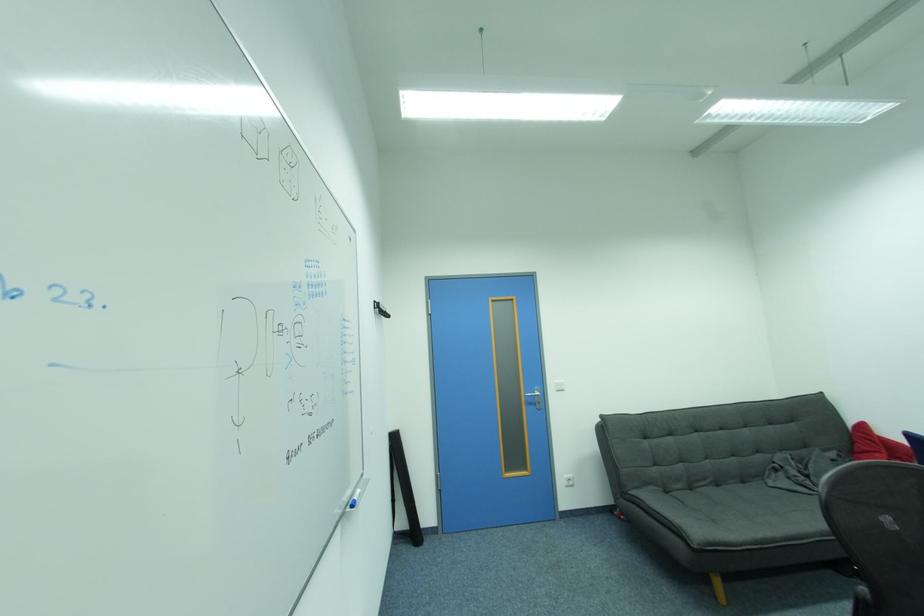
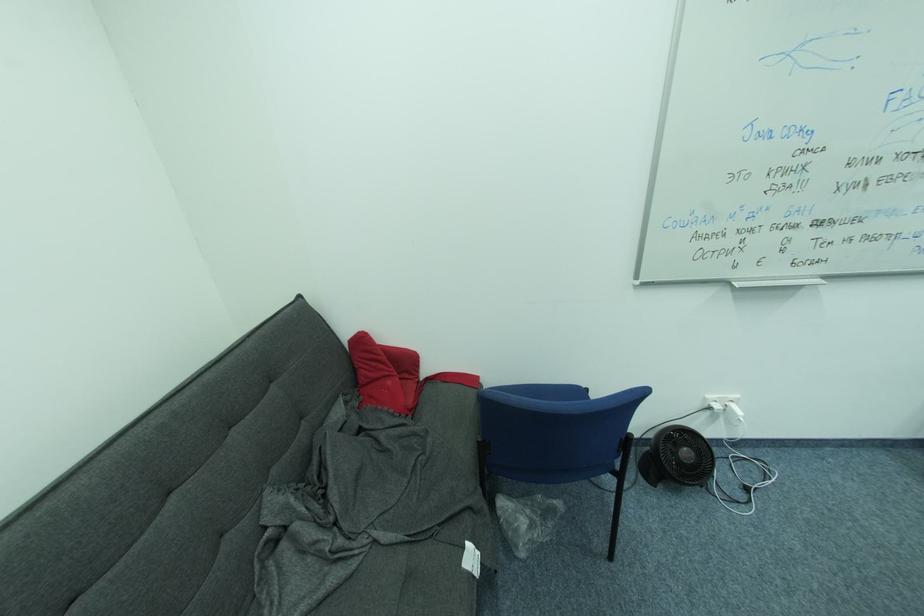
In the second image, find the point that corresponds to the point at 857,424 in the first image.

(353, 336)